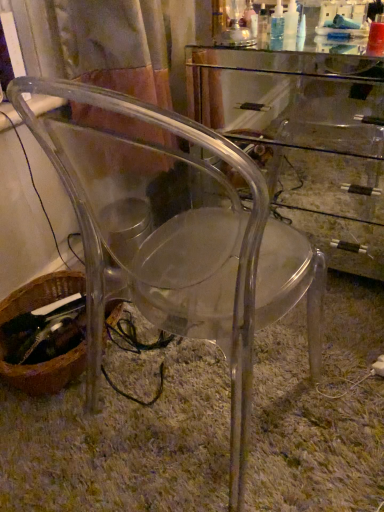
Question: Is brown woven basket at lower left oriented away from transparent acrylic computer desk at center?

Choices:
 (A) no
 (B) yes

Answer: (A)

Question: From a real-world perspective, is brown woven basket at lower left beneath transparent acrylic computer desk at center?

Choices:
 (A) no
 (B) yes

Answer: (B)

Question: From a real-world perspective, is brown woven basket at lower left located higher than transparent acrylic computer desk at center?

Choices:
 (A) no
 (B) yes

Answer: (A)

Question: Is brown woven basket at lower left bigger than transparent acrylic computer desk at center?

Choices:
 (A) no
 (B) yes

Answer: (A)

Question: Can you confirm if brown woven basket at lower left is taller than transparent acrylic computer desk at center?

Choices:
 (A) no
 (B) yes

Answer: (A)

Question: From a real-world perspective, relative to transparent acrylic computer desk at center, is brown woven basket at lower left vertically above or below?

Choices:
 (A) below
 (B) above

Answer: (A)

Question: Do you think brown woven basket at lower left is within transparent acrylic computer desk at center, or outside of it?

Choices:
 (A) outside
 (B) inside

Answer: (A)

Question: Visually, is brown woven basket at lower left positioned to the left or to the right of transparent acrylic computer desk at center?

Choices:
 (A) right
 (B) left

Answer: (B)

Question: Relative to transparent acrylic computer desk at center, is brown woven basket at lower left in front or behind?

Choices:
 (A) front
 (B) behind

Answer: (B)

Question: Is transparent acrylic chair at center in front of or behind brown woven basket at lower left in the image?

Choices:
 (A) front
 (B) behind

Answer: (A)

Question: Considering the positions of transparent acrylic chair at center and brown woven basket at lower left in the image, is transparent acrylic chair at center taller or shorter than brown woven basket at lower left?

Choices:
 (A) short
 (B) tall

Answer: (B)

Question: In terms of width, does transparent acrylic chair at center look wider or thinner when compared to brown woven basket at lower left?

Choices:
 (A) wide
 (B) thin

Answer: (A)

Question: Does point (279, 225) appear closer or farther from the camera than point (107, 310)?

Choices:
 (A) farther
 (B) closer

Answer: (B)

Question: From a real-world perspective, is transparent acrylic chair at center above or below transparent acrylic computer desk at center?

Choices:
 (A) above
 (B) below

Answer: (A)

Question: Considering the positions of transparent acrylic chair at center and transparent acrylic computer desk at center in the image, is transparent acrylic chair at center wider or thinner than transparent acrylic computer desk at center?

Choices:
 (A) wide
 (B) thin

Answer: (A)